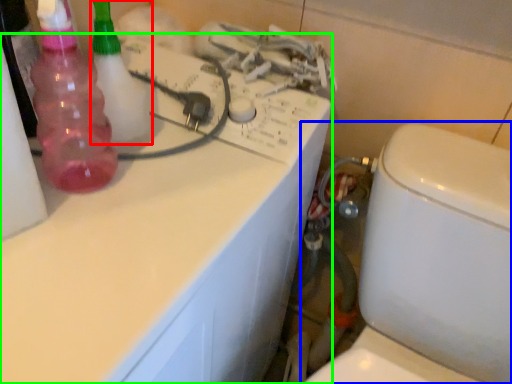
Question: Based on their relative distances, which object is farther from cleaning product (highlighted by a red box)? Choose from toilet (highlighted by a blue box) and counter top (highlighted by a green box).

Choices:
 (A) toilet
 (B) counter top

Answer: (A)